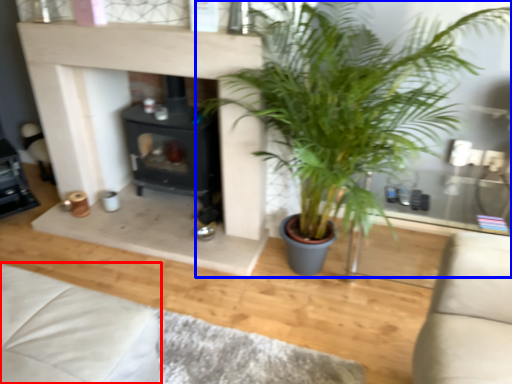
Question: Which object appears closest to the camera in this image, couch (highlighted by a red box) or houseplant (highlighted by a blue box)?

Choices:
 (A) couch
 (B) houseplant

Answer: (B)